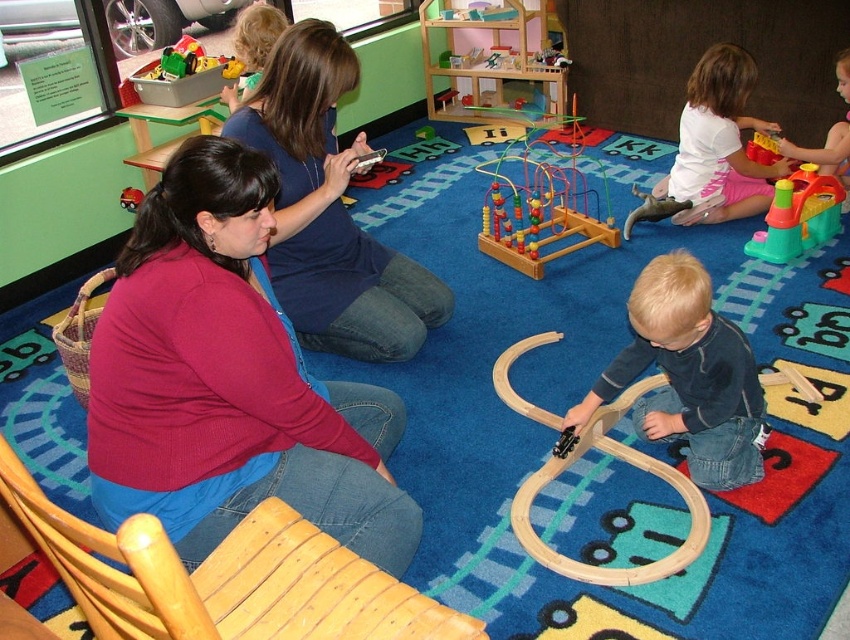
You are a parent looking for a toy for your child. You see the wooden train track at center and the smooth plastic toy at upper right. Which toy is positioned to the left side of the other?

The wooden train track at center is to the left of the smooth plastic toy at upper right.

You are a parent trying to place a new toy box between the wooden dollhouse at center and the translucent plastic toy at upper right. The toy box requires 1.2 meters of space. Can you fit it there based on their widths?

The wooden dollhouse at center might be wider than the translucent plastic toy at upper right, so the combined width of both objects could exceed the required 1.2 meters. It is uncertain if there is enough space without knowing their exact widths.